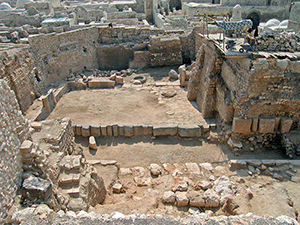
The image size is (300, 225). I want to click on stairs, so click(68, 180), click(67, 189).